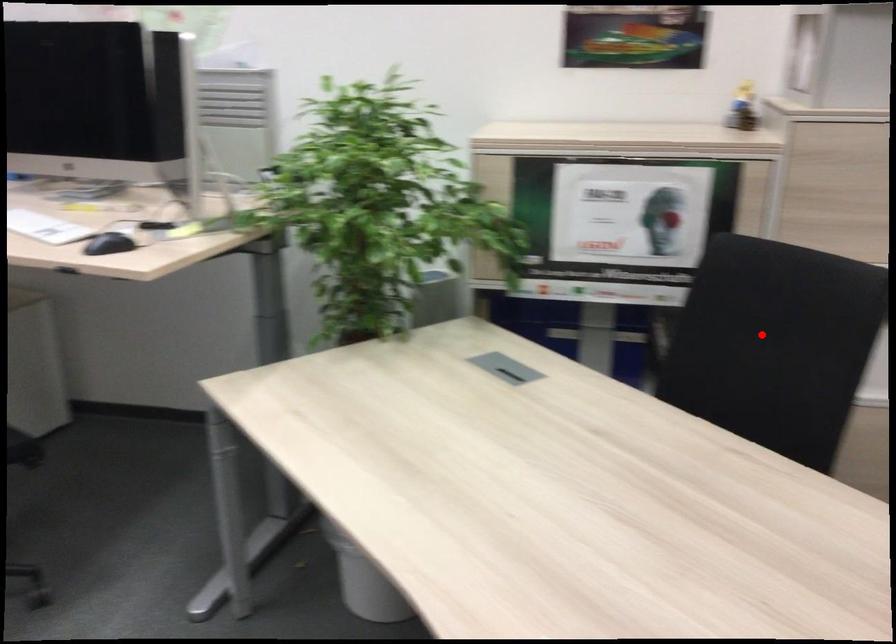
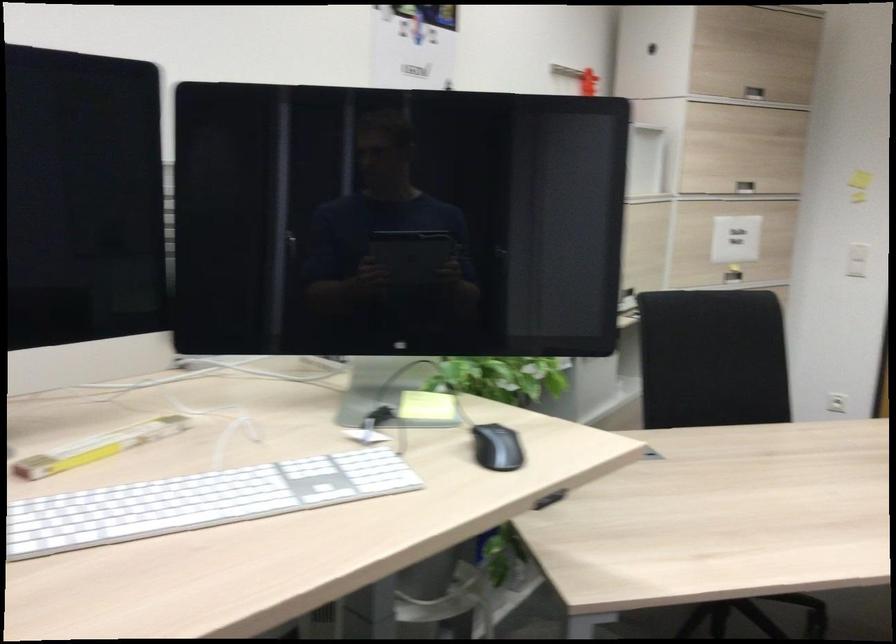
Question: I am providing you with two images of the same scene from different viewpoints. A red point is shown in image1. For the corresponding object point in image2, is it positioned nearer or farther from the camera?

Choices:
 (A) Nearer
 (B) Farther

Answer: (B)